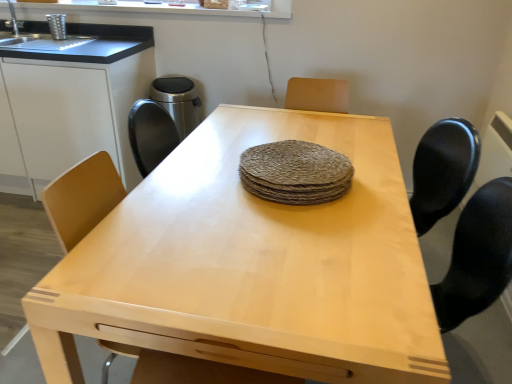
Question: Is white matte cabinet at left bigger than light wood table at center?

Choices:
 (A) yes
 (B) no

Answer: (B)

Question: From a real-world perspective, is white matte cabinet at left below light wood table at center?

Choices:
 (A) no
 (B) yes

Answer: (A)

Question: Would you say white matte cabinet at left is outside light wood table at center?

Choices:
 (A) yes
 (B) no

Answer: (A)

Question: Is light wood table at center inside white matte cabinet at left?

Choices:
 (A) no
 (B) yes

Answer: (A)

Question: Is white matte cabinet at left far from light wood table at center?

Choices:
 (A) no
 (B) yes

Answer: (B)

Question: From the image's perspective, is white matte cabinet at left beneath light wood table at center?

Choices:
 (A) yes
 (B) no

Answer: (B)

Question: Is light wood table at center thinner than white matte cabinet at left?

Choices:
 (A) yes
 (B) no

Answer: (B)

Question: Could you tell me if light wood table at center is facing white matte cabinet at left?

Choices:
 (A) no
 (B) yes

Answer: (B)

Question: Is light wood table at center wider than white matte cabinet at left?

Choices:
 (A) no
 (B) yes

Answer: (B)

Question: Can you confirm if light wood table at center is shorter than white matte cabinet at left?

Choices:
 (A) no
 (B) yes

Answer: (B)

Question: Considering the relative sizes of light wood table at center and white matte cabinet at left in the image provided, is light wood table at center smaller than white matte cabinet at left?

Choices:
 (A) yes
 (B) no

Answer: (B)

Question: Is light wood table at center positioned far away from white matte cabinet at left?

Choices:
 (A) yes
 (B) no

Answer: (A)

Question: From a real-world perspective, does rough woven placemat at center sit lower than white matte cabinet at left?

Choices:
 (A) yes
 (B) no

Answer: (B)